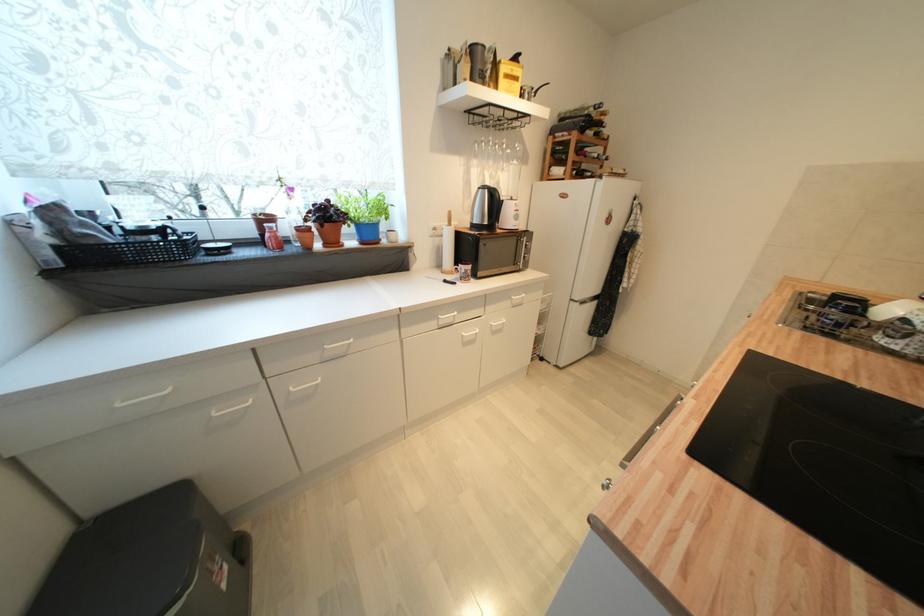
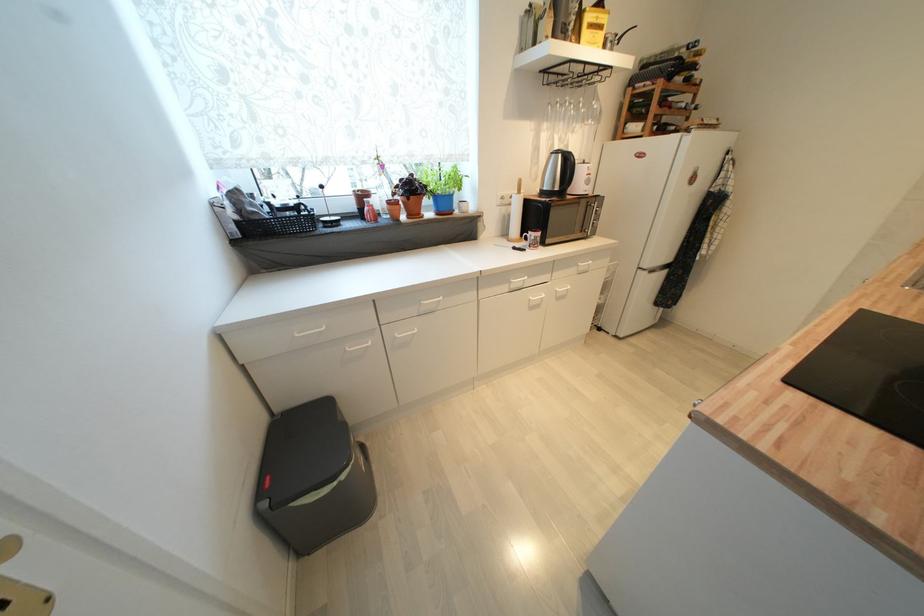
Find the pixel in the second image that matches point 507,152 in the first image.

(582, 111)